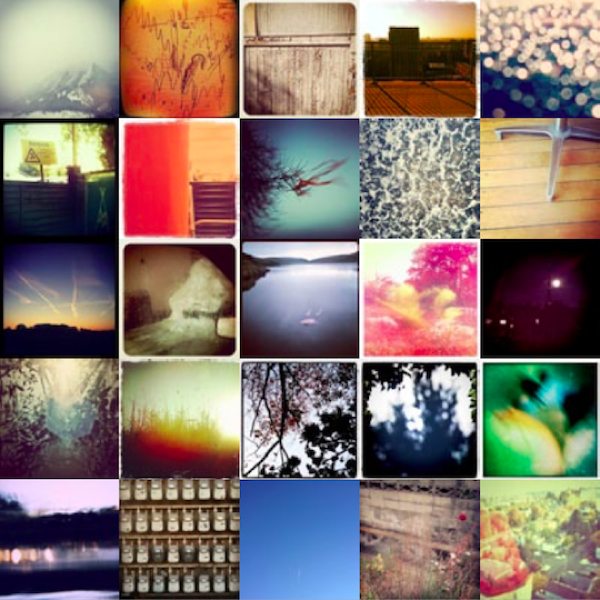
Where is `interior photos`? Image resolution: width=600 pixels, height=600 pixels. interior photos is located at coordinates point(162,323), point(517,181), point(193,171), point(317,67), point(49,186).